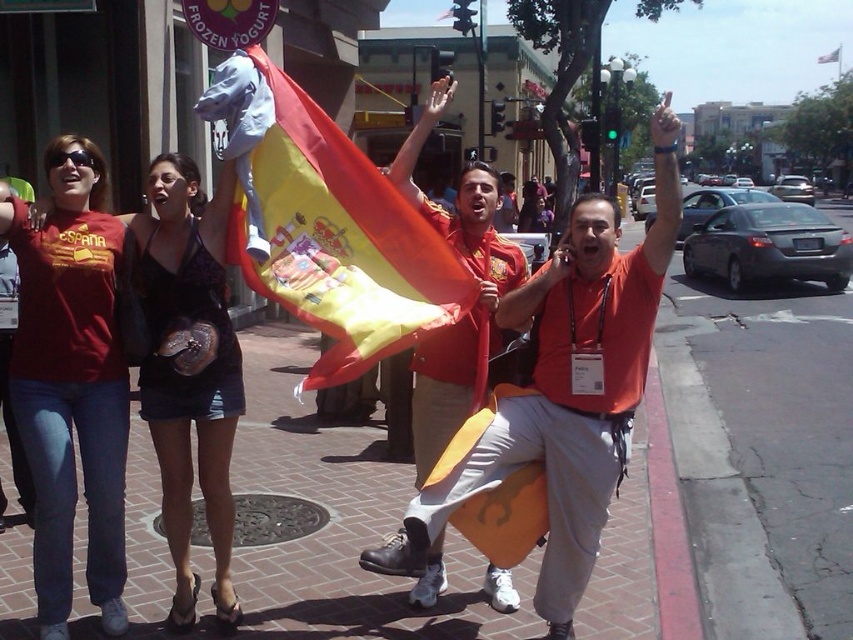
You are a photographer trying to capture the Spanish flag being waved by the group. You want to focus on the point at the center of the flag, which is at point [329,237]. However, there is a distraction at point [486,172]. To minimize the distraction, should you adjust your camera to focus closer or farther away?

The point at [329,237] is closer to the camera than the point at [486,172]. To minimize the distraction from the point at [486,172], you should focus closer to keep the point at [329,237] in focus while blurring the farther distraction.

You are standing on the sidewalk and want to reach the orange fabric flag at center without stepping on the brick pavement at center. Is this possible?

The brick pavement at center is further to the viewer than orange fabric flag at center, so you can reach the orange fabric flag at center without stepping on the brick pavement at center by moving forward since the flag is closer to you than the pavement.